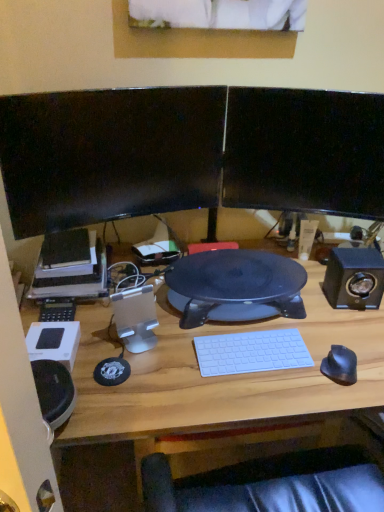
Question: Looking at the image, does black plastic desk at center seem bigger or smaller compared to matte black printer at left?

Choices:
 (A) small
 (B) big

Answer: (B)

Question: From a real-world perspective, is black plastic desk at center physically located above or below matte black printer at left?

Choices:
 (A) below
 (B) above

Answer: (A)

Question: Estimate the real-world distances between objects in this image. Which object is closer to the white plastic keyboard at center?

Choices:
 (A) white plastic speaker at center, the 2th speaker in the right-to-left sequence
 (B) black plastic calculator at left
 (C) black matte mouse at right
 (D) black glossy monitor at upper left, positioned as the second computer monitor in right-to-left order
 (E) black glossy monitor at upper right, the 1th computer monitor positioned from the right

Answer: (C)

Question: Estimate the real-world distances between objects in this image. Which object is closer to the matte black printer at left?

Choices:
 (A) black matte mouse at right
 (B) black plastic desk at center
 (C) white plastic speaker at center, the 2th speaker in the right-to-left sequence
 (D) black plastic calculator at left
 (E) white plastic keyboard at center

Answer: (D)